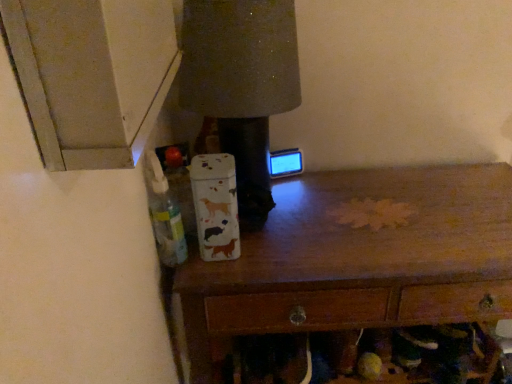
Locate an element on the screen. Image resolution: width=512 pixels, height=384 pixels. vacant area that is situated to the right of translucent plastic bottle at left is located at coordinates (265, 252).